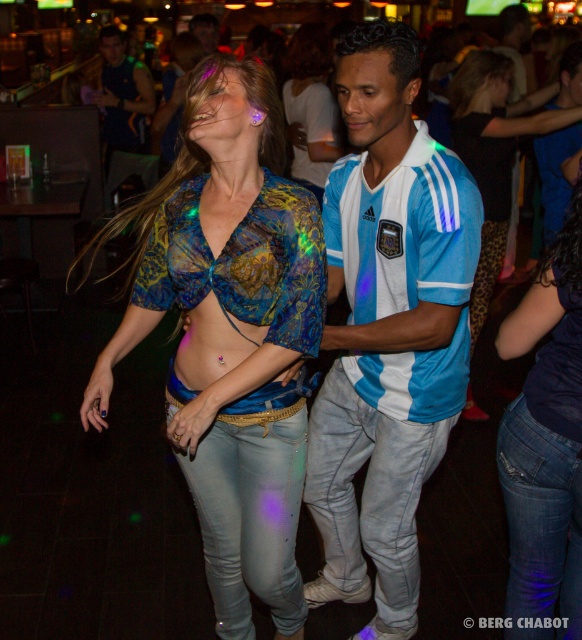
Question: Which point is farther to the camera?

Choices:
 (A) shiny blue fabric top at center
 (B) blue jersey at center
 (C) denim jeans at lower right
 (D) denim jeans at center

Answer: (D)

Question: Which of the following is the closest to the observer?

Choices:
 (A) (278, 353)
 (B) (512, 419)

Answer: (A)

Question: Is the position of blue jersey at center less distant than that of denim jeans at center?

Choices:
 (A) no
 (B) yes

Answer: (B)

Question: Considering the relative positions of shiny blue fabric top at center and blue jersey at center in the image provided, where is shiny blue fabric top at center located with respect to blue jersey at center?

Choices:
 (A) below
 (B) above

Answer: (A)

Question: Does denim jeans at lower right have a greater width compared to denim jeans at center?

Choices:
 (A) yes
 (B) no

Answer: (B)

Question: Among these objects, which one is farthest from the camera?

Choices:
 (A) denim jeans at lower right
 (B) blue jersey at center
 (C) shiny blue fabric top at center

Answer: (B)